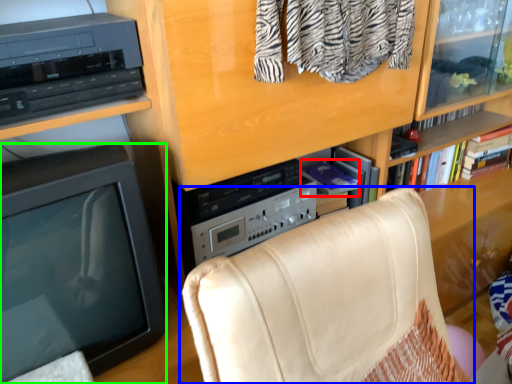
Question: Which object is positioned farthest from book (highlighted by a red box)? Select from chair (highlighted by a blue box) and television (highlighted by a green box).

Choices:
 (A) chair
 (B) television

Answer: (B)